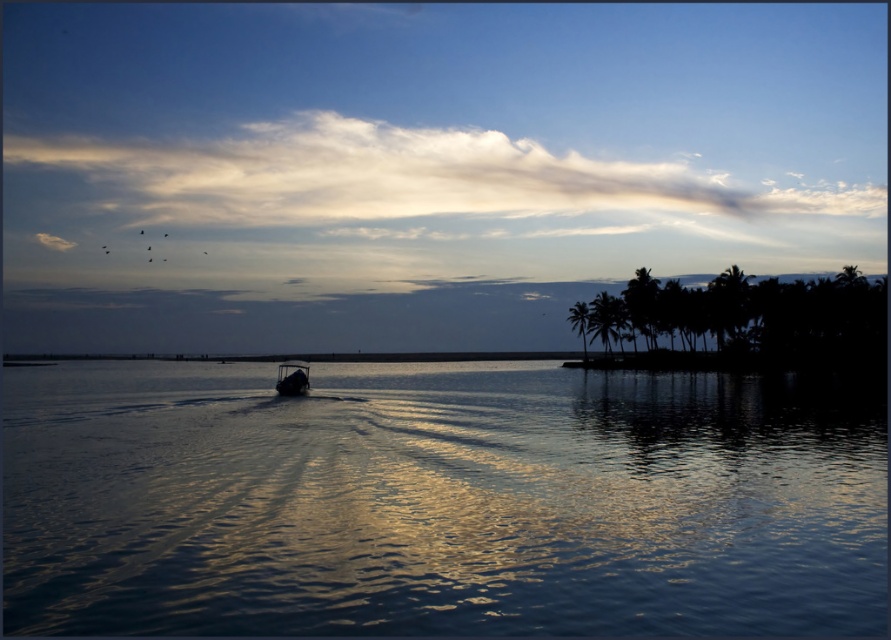
You are standing on the shore looking at the coastal scene. There are two points marked in the image. The first point is at coordinates point [149,589] and the second point is at point [289,378]. Which point is closer to you?

Point [149,589] is in front of point [289,378], so it is closer to you.

You are standing on the shore and see the glistening blue water at center and the metallic silver boat at center. Which object is closer to you?

The glistening blue water at center is closer to the viewer than the metallic silver boat at center.